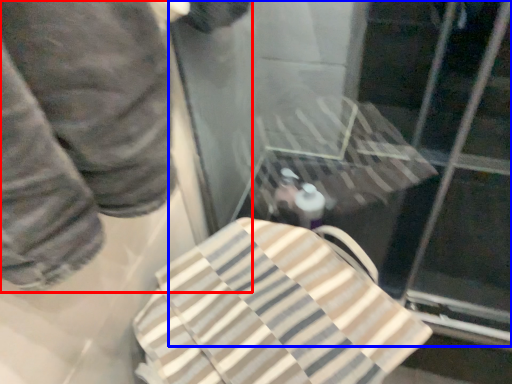
Question: Among these objects, which one is farthest to the camera, person (highlighted by a red box) or glass door (highlighted by a blue box)?

Choices:
 (A) person
 (B) glass door

Answer: (B)